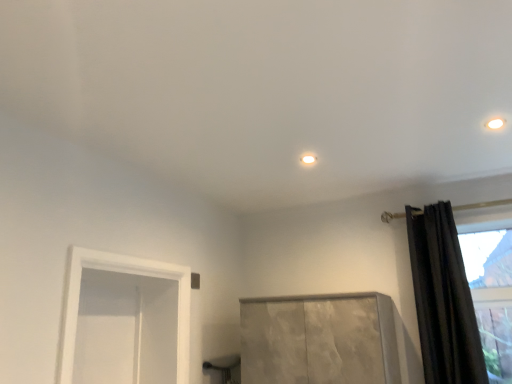
Question: Can you confirm if matte white light fixture at upper right, which is the first lighting in right-to-left order, is wider than white glossy light fixture at center, positioned as the second lighting in top-to-bottom order?

Choices:
 (A) yes
 (B) no

Answer: (A)

Question: Does matte white light fixture at upper right, placed as the second lighting when sorted from left to right, have a lesser height compared to white glossy light fixture at center, marked as the 1th lighting in a back-to-front arrangement?

Choices:
 (A) yes
 (B) no

Answer: (B)

Question: Can you confirm if matte white light fixture at upper right, positioned as the 1th lighting in top-to-bottom order, is smaller than white glossy light fixture at center, the second lighting when ordered from right to left?

Choices:
 (A) no
 (B) yes

Answer: (A)

Question: From a real-world perspective, is matte white light fixture at upper right, arranged as the first lighting when viewed from the front, physically above white glossy light fixture at center, the 1th lighting from the bottom?

Choices:
 (A) no
 (B) yes

Answer: (A)

Question: Can you confirm if matte white light fixture at upper right, arranged as the second lighting when viewed from the back, is taller than white glossy light fixture at center, which appears as the first lighting when viewed from the left?

Choices:
 (A) yes
 (B) no

Answer: (A)

Question: Considering the relative positions of black velvet curtain at right and white glossy light fixture at center, marked as the 1th lighting in a back-to-front arrangement, in the image provided, is black velvet curtain at right to the left or to the right of white glossy light fixture at center, marked as the 1th lighting in a back-to-front arrangement,?

Choices:
 (A) left
 (B) right

Answer: (B)

Question: From a real-world perspective, relative to white glossy light fixture at center, the second lighting when ordered from right to left, is black velvet curtain at right vertically above or below?

Choices:
 (A) above
 (B) below

Answer: (B)

Question: In terms of size, does black velvet curtain at right appear bigger or smaller than white glossy light fixture at center, the second lighting positioned from the front?

Choices:
 (A) small
 (B) big

Answer: (B)

Question: From their relative heights in the image, would you say black velvet curtain at right is taller or shorter than white glossy light fixture at center, the second lighting positioned from the front?

Choices:
 (A) short
 (B) tall

Answer: (B)

Question: From the image's perspective, is black velvet curtain at right located above or below matte white light fixture at upper right, arranged as the first lighting when viewed from the front?

Choices:
 (A) below
 (B) above

Answer: (A)

Question: Considering the positions of black velvet curtain at right and matte white light fixture at upper right, arranged as the second lighting when viewed from the back, in the image, is black velvet curtain at right bigger or smaller than matte white light fixture at upper right, arranged as the second lighting when viewed from the back,?

Choices:
 (A) big
 (B) small

Answer: (A)

Question: From a real-world perspective, is black velvet curtain at right positioned above or below matte white light fixture at upper right, positioned as the 1th lighting in top-to-bottom order?

Choices:
 (A) below
 (B) above

Answer: (A)

Question: Is black velvet curtain at right in front of or behind matte white light fixture at upper right, arranged as the second lighting when viewed from the back, in the image?

Choices:
 (A) behind
 (B) front

Answer: (A)

Question: Is matte white light fixture at upper right, positioned as the 1th lighting in top-to-bottom order, inside or outside of white glossy light fixture at center, the 1th lighting from the bottom?

Choices:
 (A) inside
 (B) outside

Answer: (B)

Question: From the image's perspective, is matte white light fixture at upper right, placed as the second lighting when sorted from left to right, positioned above or below white glossy light fixture at center, marked as the 1th lighting in a back-to-front arrangement?

Choices:
 (A) below
 (B) above

Answer: (B)